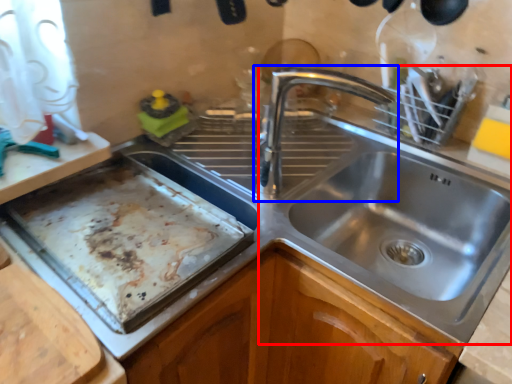
Question: Which point is further to the camera, sink (highlighted by a red box) or tap (highlighted by a blue box)?

Choices:
 (A) sink
 (B) tap

Answer: (B)